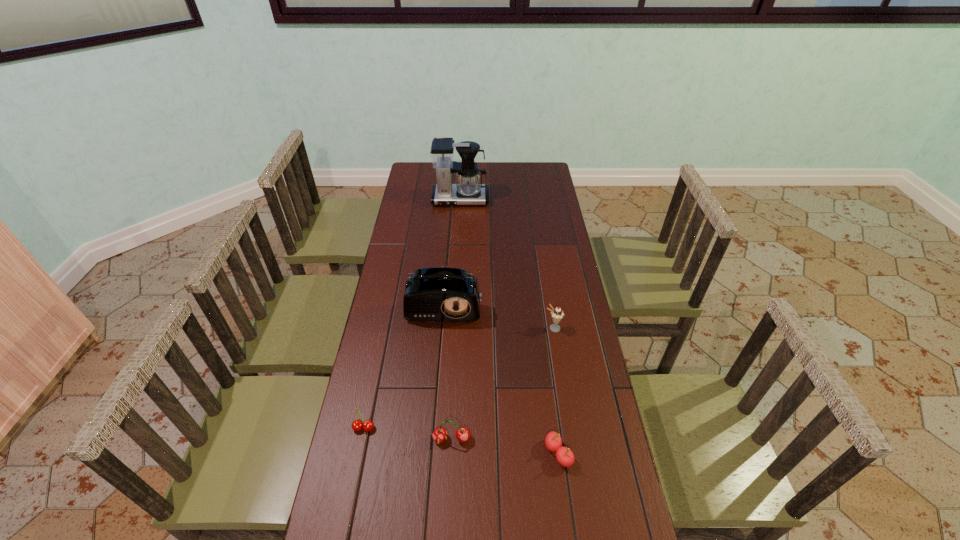
Identify the location of vacant space at the left edge of the desktop. This screenshot has width=960, height=540. (374, 326).

Locate an element on the screen. vacant space at the right edge of the desktop is located at coordinates (561, 302).

What are the coordinates of `unoccupied position between the icecream and the rightmost cherry` in the screenshot? It's located at (556, 391).

Locate an element on the screen. Image resolution: width=960 pixels, height=540 pixels. unoccupied area between the tallest cherry and the third tallest object is located at coordinates (502, 384).

The image size is (960, 540). In order to click on free space between the coffee maker and the rightmost cherry in this screenshot , I will do `click(509, 326)`.

Locate an element on the screen. This screenshot has width=960, height=540. empty space between the leftmost object and the fifth shortest object is located at coordinates (404, 362).

Find the location of `free space between the icecream and the radio receiver`. free space between the icecream and the radio receiver is located at coordinates (499, 312).

Where is `vacant space in between the radio receiver and the rightmost cherry`? This screenshot has height=540, width=960. vacant space in between the radio receiver and the rightmost cherry is located at coordinates (502, 374).

At what (x,y) coordinates should I click in order to perform the action: click on unoccupied area between the second cherry from left to right and the leftmost object. Please return your answer as a coordinate pair (x, y). This screenshot has width=960, height=540. Looking at the image, I should click on (408, 434).

Identify which object is located as the fourth nearest to the second cherry from left to right. Please provide its 2D coordinates. Your answer should be formatted as a tuple, i.e. [(x, y)], where the tuple contains the x and y coordinates of a point satisfying the conditions above.

[(557, 314)]